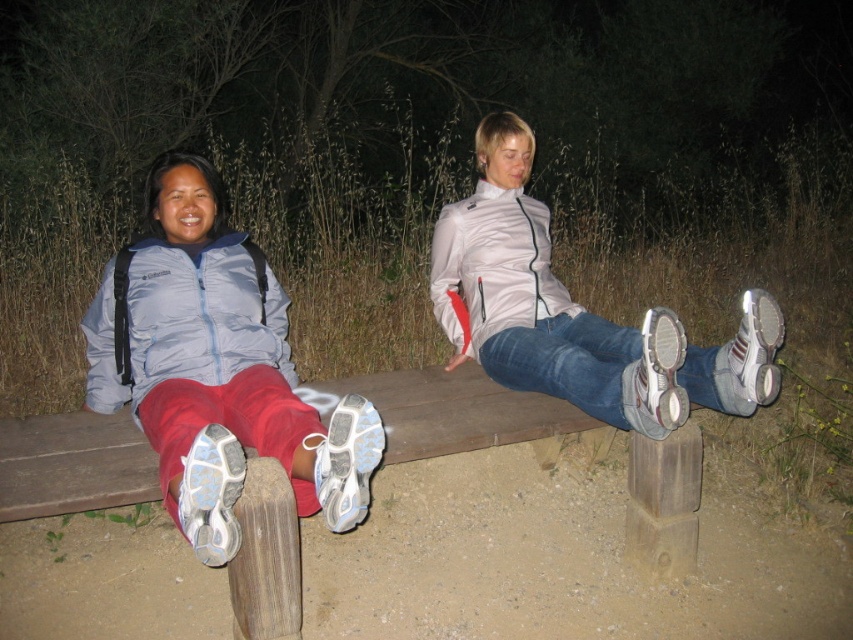
In the scene shown: Is matte blue jacket at left taller than white matte sneakers at center?

In fact, matte blue jacket at left may be shorter than white matte sneakers at center.

Does matte blue jacket at left appear on the left side of white matte sneakers at center?

Indeed, matte blue jacket at left is positioned on the left side of white matte sneakers at center.

The height and width of the screenshot is (640, 853). What do you see at coordinates (218, 369) in the screenshot?
I see `matte blue jacket at left` at bounding box center [218, 369].

You are a GUI agent. You are given a task and a screenshot of the screen. Output one action in this format:
    pyautogui.click(x=<x>, y=<y>)
    Task: Click on the matte blue jacket at left
    Image resolution: width=853 pixels, height=640 pixels.
    Given the screenshot: What is the action you would take?
    pyautogui.click(x=218, y=369)